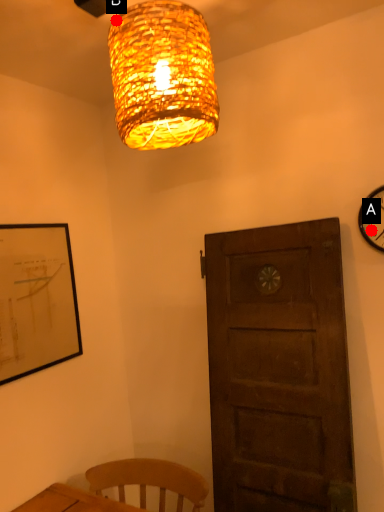
Question: Two points are circled on the image, labeled by A and B beside each circle. Among these points, which one is nearest to the camera?

Choices:
 (A) A is closer
 (B) B is closer

Answer: (B)